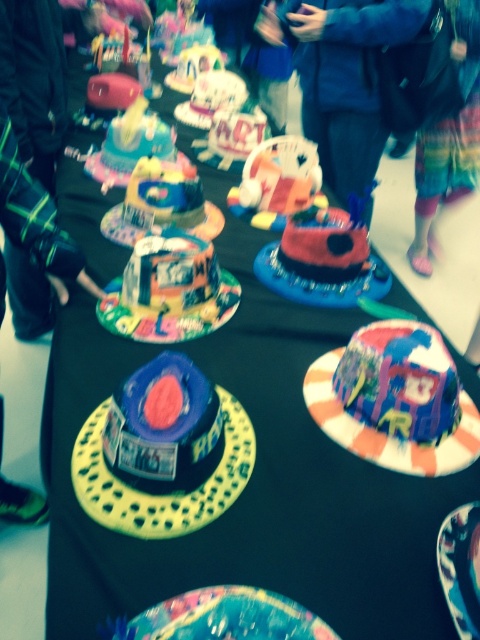
Question: Does blue matte hat at center appear on the left side of multicolored fabric hat at lower right?

Choices:
 (A) yes
 (B) no

Answer: (A)

Question: Is painted cardboard hat at center above matte pink cake at center?

Choices:
 (A) yes
 (B) no

Answer: (B)

Question: Which of these objects is positioned farthest from the painted cardboard hat at center?

Choices:
 (A) matte blue hat at center
 (B) multicolored fabric hat at lower right
 (C) blue matte hat at center

Answer: (A)

Question: Estimate the real-world distances between objects in this image. Which object is farther from the blue fabric pants at center?

Choices:
 (A) matte colorful hat at center
 (B) blue matte hat at center
 (C) colorful paper plate at center

Answer: (B)

Question: Is painted cardboard hat at center bigger than multicolored fabric hat at lower right?

Choices:
 (A) no
 (B) yes

Answer: (A)

Question: Which is farther from the blue fabric pants at center?

Choices:
 (A) matte colorful hat at center
 (B) translucent plastic bubble at center
 (C) painted cardboard hat at center

Answer: (B)